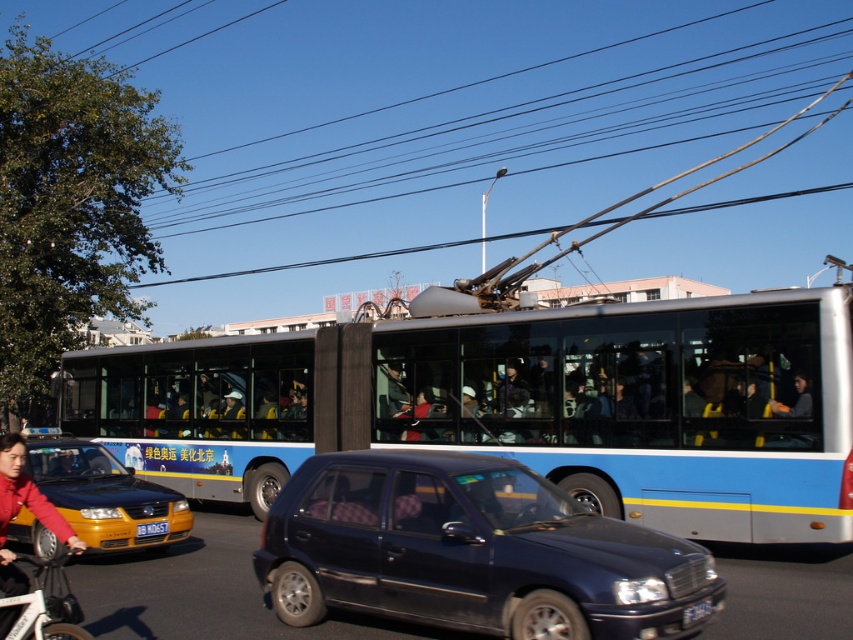
You are a pedestrian standing on the sidewalk and see the blue metallic bus at center and the blue metallic license plate at center in the street. Which one is located to the right from your perspective?

The blue metallic bus at center is positioned on the right side of the blue metallic license plate at center, so from your perspective as a pedestrian on the sidewalk, the blue metallic bus at center is to the right of the blue metallic license plate at center.

You are a pedestrian standing on the sidewalk and see both the yellow matte taxi at lower left and the white matte bicycle at lower left. Which one is closer to the ground?

The yellow matte taxi at lower left is below the white matte bicycle at lower left, so the yellow matte taxi at lower left is closer to the ground.